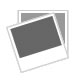
The height and width of the screenshot is (80, 80). What are the coordinates of `white space above and below slanted picture` in the screenshot? It's located at (27, 22), (45, 57).